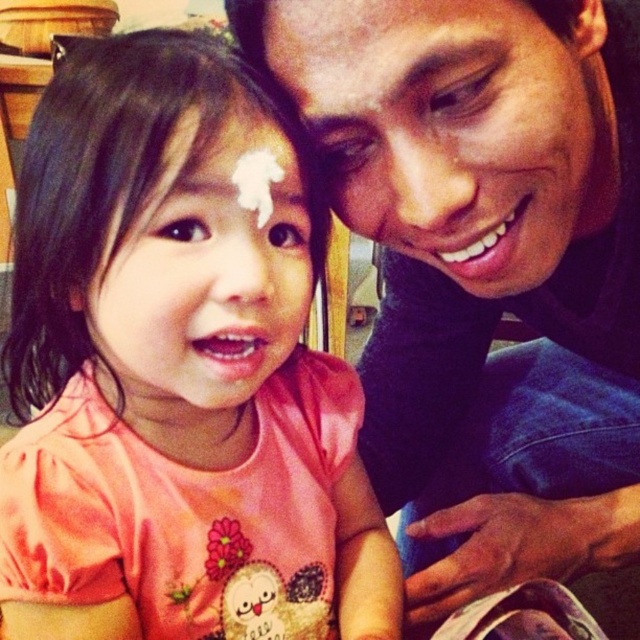
Question: Does pink matte shirt at center have a lesser width compared to pink matte face at center?

Choices:
 (A) yes
 (B) no

Answer: (B)

Question: Can you confirm if smooth skin face at upper right is thinner than pink matte face at center?

Choices:
 (A) no
 (B) yes

Answer: (A)

Question: Is pink matte shirt at center bigger than smooth skin face at upper right?

Choices:
 (A) no
 (B) yes

Answer: (B)

Question: Which of the following is the closest to the observer?

Choices:
 (A) pink matte shirt at center
 (B) white sugar icing at center
 (C) pink matte face at center
 (D) smooth skin face at upper right

Answer: (A)

Question: Which object appears closest to the camera in this image?

Choices:
 (A) pink matte shirt at center
 (B) white sugar icing at center
 (C) smooth skin face at upper right

Answer: (A)

Question: Which object appears closest to the camera in this image?

Choices:
 (A) white sugar icing at center
 (B) smooth skin face at upper right
 (C) pink matte face at center

Answer: (B)